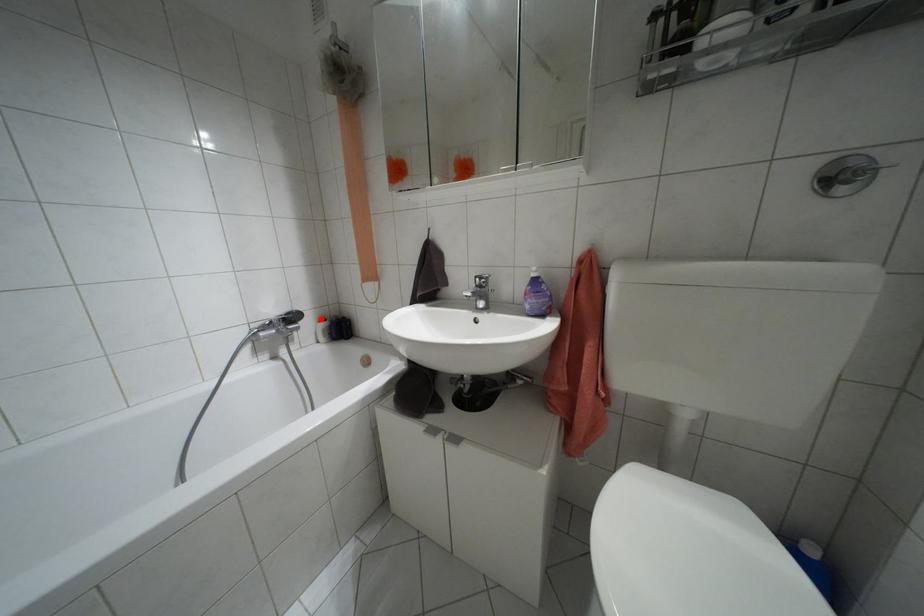
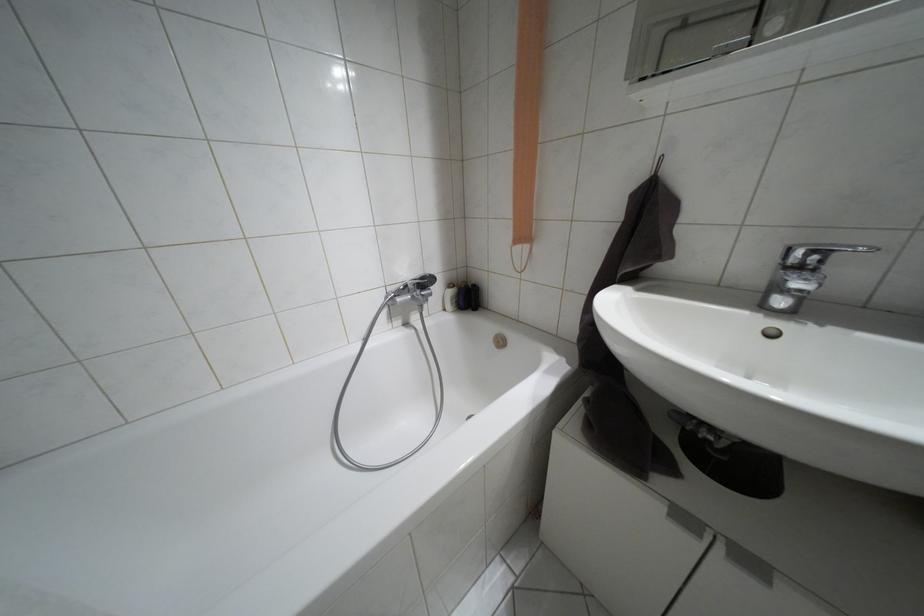
The point at the highlighted location is marked in the first image. Where is the corresponding point in the second image?

(448, 285)